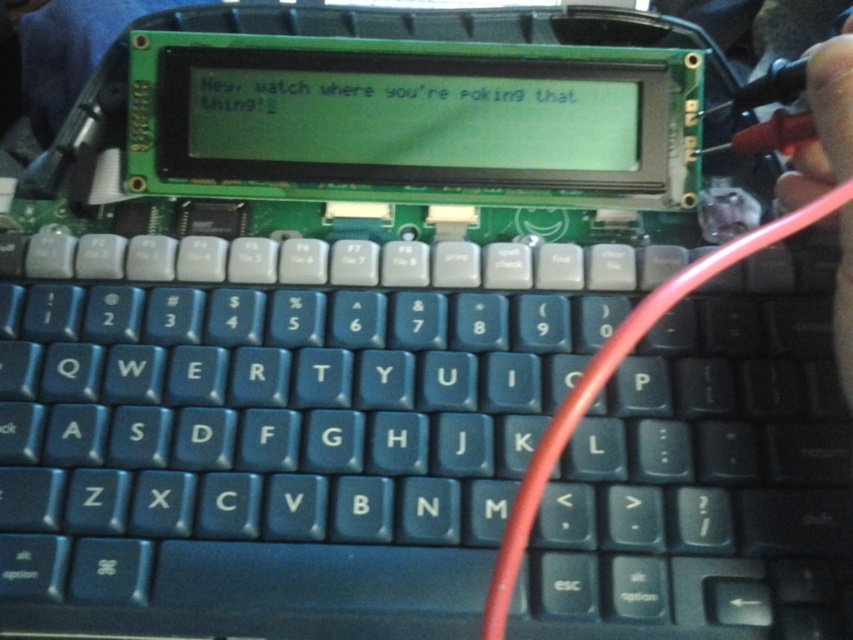
You are using a laptop with a green LCD screen and a dark blue keyboard. You notice two points on the screen at coordinates point (804, 337) and point (824, 200). If you want to touch the point that is closer to you, which one should you choose?

Point (824, 200) is closer to you because it is in front of point (804, 337), which is behind it.